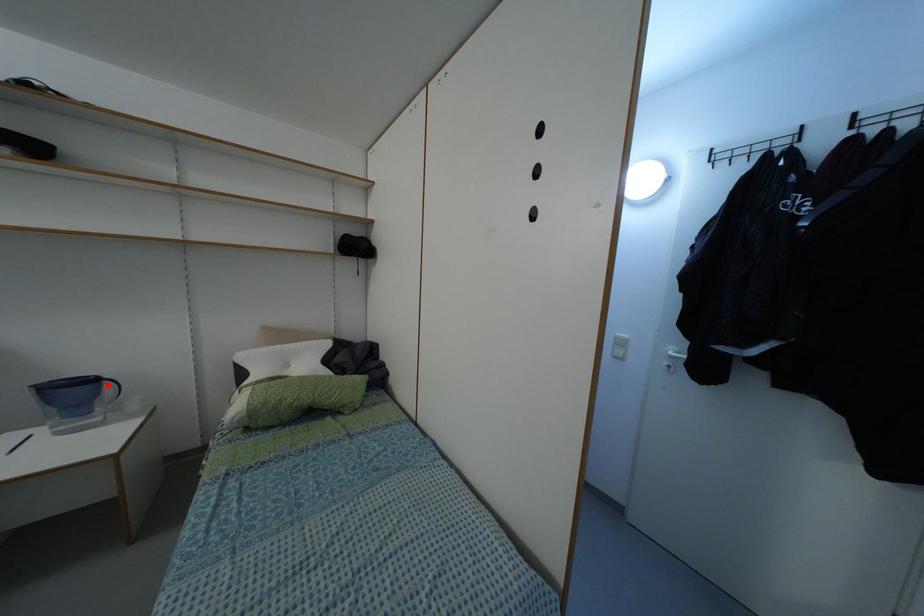
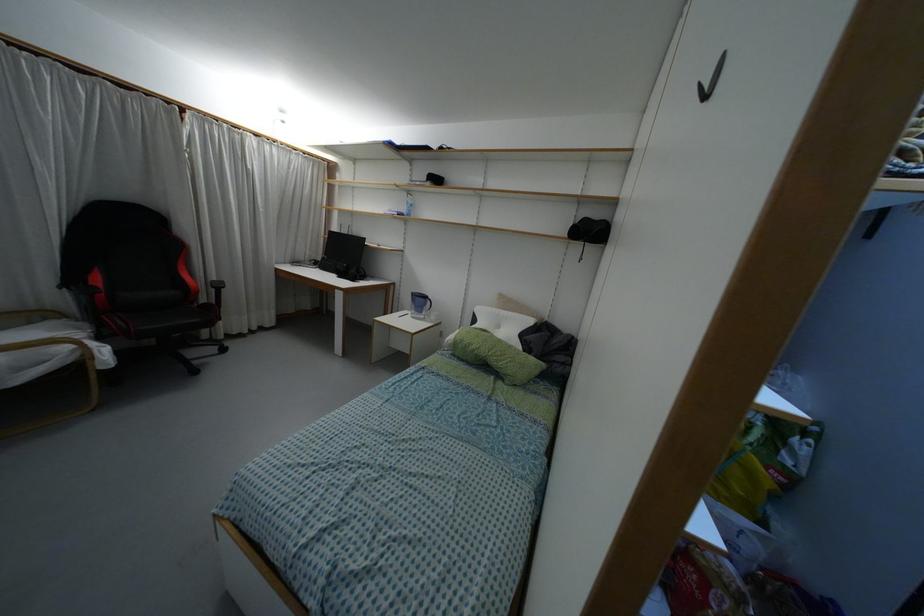
The point at the highlighted location is marked in the first image. Where is the corresponding point in the second image?

(428, 302)